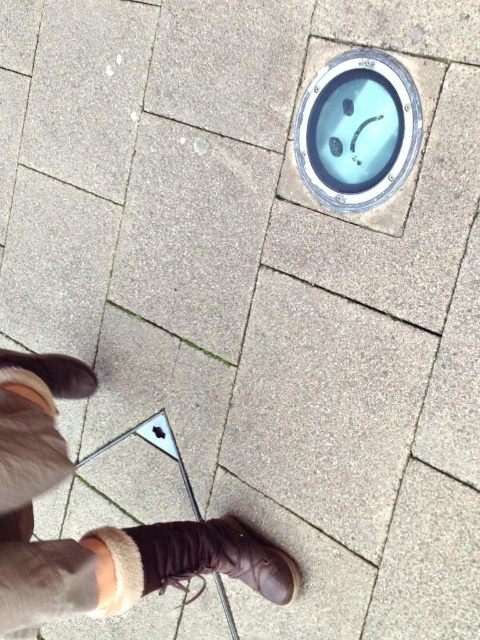
Question: Considering the relative positions of brown suede boots at lower center and brown suede boot at lower left in the image provided, where is brown suede boots at lower center located with respect to brown suede boot at lower left?

Choices:
 (A) above
 (B) below

Answer: (B)

Question: Does brown suede boots at lower center appear over brown suede boot at lower center?

Choices:
 (A) no
 (B) yes

Answer: (B)

Question: Considering the real-world distances, which object is farthest from the brown suede boot at lower center?

Choices:
 (A) brown suede boots at lower center
 (B) blue glossy manhole cover at upper center

Answer: (B)

Question: Does brown suede boots at lower center appear on the right side of brown suede boot at lower center?

Choices:
 (A) no
 (B) yes

Answer: (A)

Question: Among these points, which one is farthest from the camera?

Choices:
 (A) (64, 358)
 (B) (149, 568)
 (C) (380, 132)
 (D) (49, 376)

Answer: (A)

Question: Based on their relative distances, which object is nearer to the brown suede boot at lower left?

Choices:
 (A) brown suede boots at lower center
 (B) brown suede boot at lower center
 (C) blue glossy manhole cover at upper center

Answer: (A)